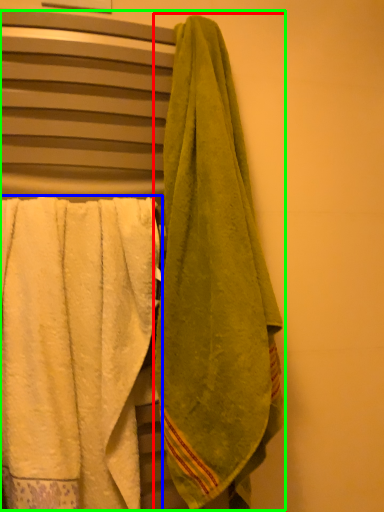
Question: Which is nearer to the towel (highlighted by a red box)? towel (highlighted by a blue box) or laundry (highlighted by a green box).

Choices:
 (A) towel
 (B) laundry

Answer: (B)